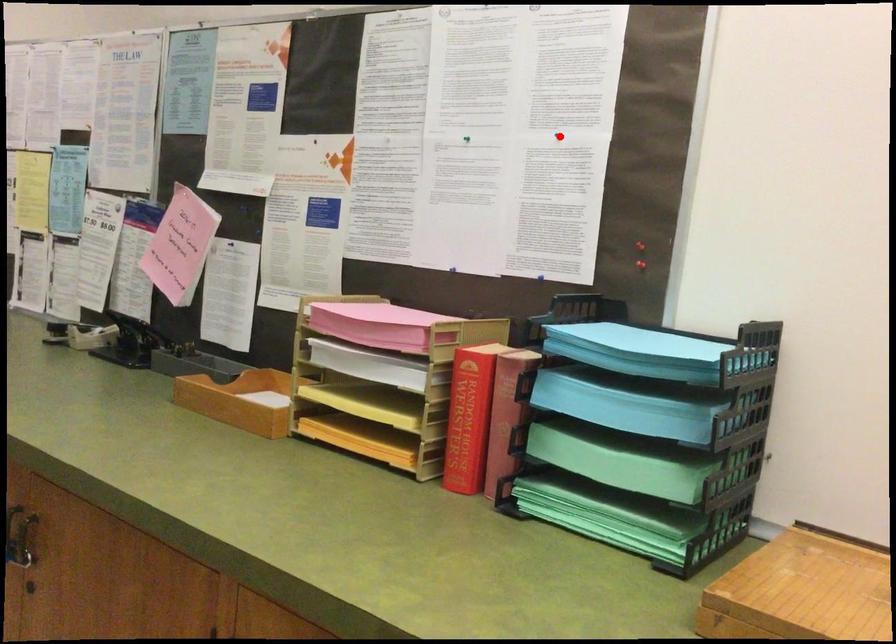
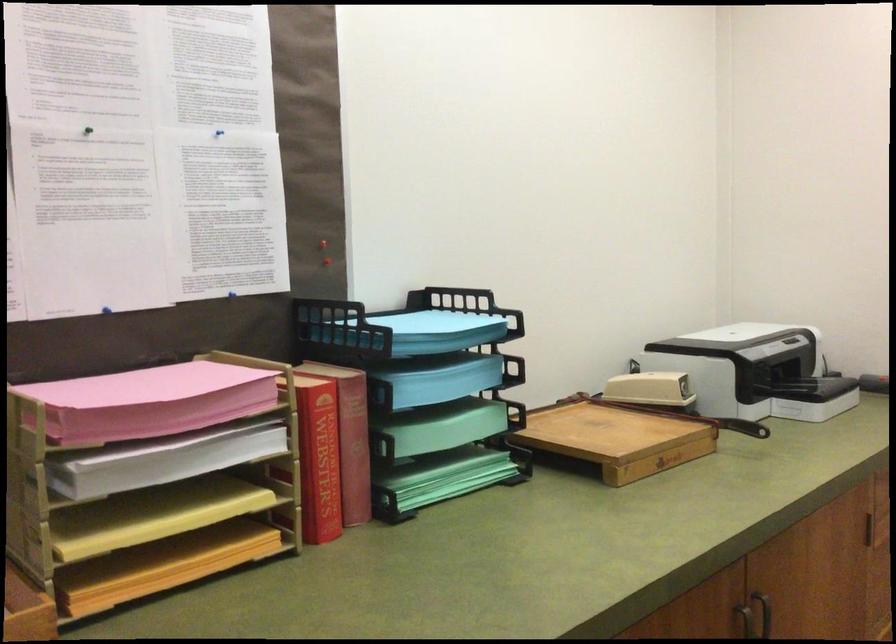
The point at the highlighted location is marked in the first image. Where is the corresponding point in the second image?

(218, 136)